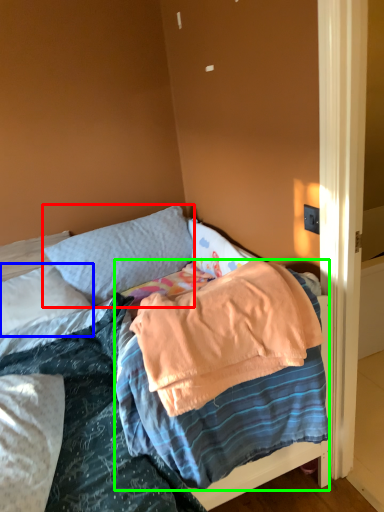
Question: Which object is positioned closest to pillow (highlighted by a red box)? Select from pillow (highlighted by a blue box) and blanket (highlighted by a green box).

Choices:
 (A) pillow
 (B) blanket

Answer: (A)